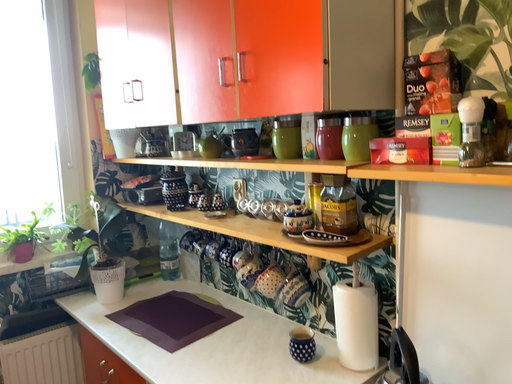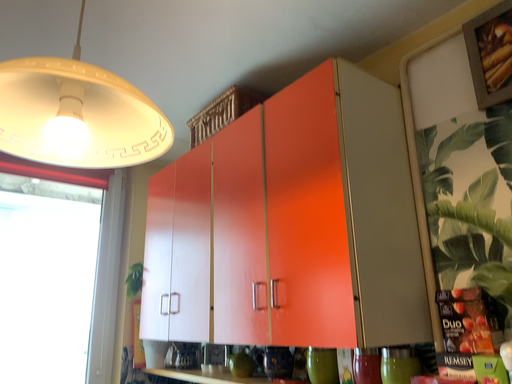
Question: Which way did the camera rotate in the video?

Choices:
 (A) rotated downward
 (B) rotated upward

Answer: (B)